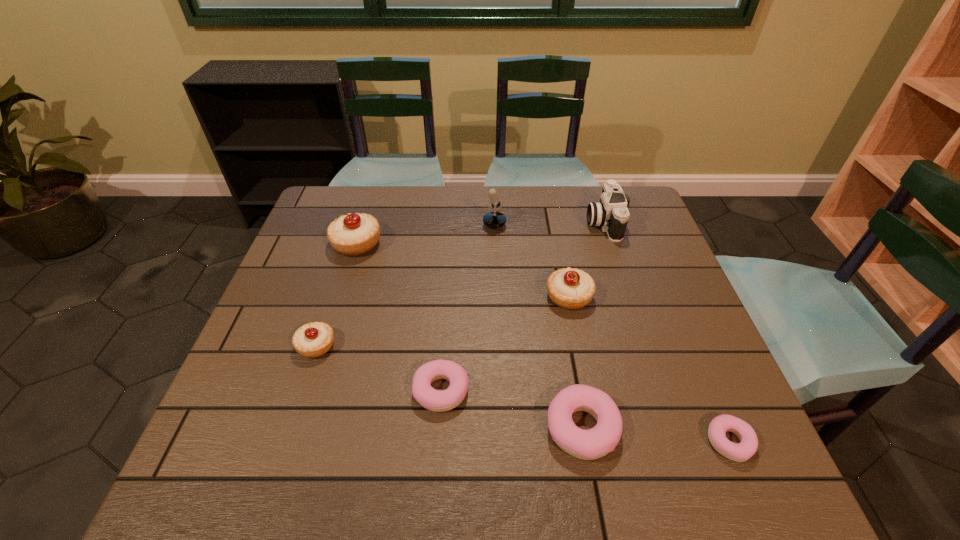
What are the coordinates of `free location located 0.060m on the left of the third shortest object` in the screenshot? It's located at (516, 428).

This screenshot has height=540, width=960. Find the location of `vacant space located on the back of the seventh tallest object`. vacant space located on the back of the seventh tallest object is located at coordinates (445, 333).

The width and height of the screenshot is (960, 540). Find the location of `vacant space situated 0.180m on the left of the rightmost object`. vacant space situated 0.180m on the left of the rightmost object is located at coordinates (614, 441).

The image size is (960, 540). In order to click on microphone at the far edge in this screenshot , I will do `click(495, 219)`.

The image size is (960, 540). In order to click on camera at the far edge in this screenshot , I will do `click(611, 213)`.

The height and width of the screenshot is (540, 960). I want to click on pastry situated at the far edge, so click(354, 234).

The height and width of the screenshot is (540, 960). In order to click on camera positioned at the right edge in this screenshot , I will do `click(611, 213)`.

Find the location of `pastry located in the right edge section of the desktop`. pastry located in the right edge section of the desktop is located at coordinates (748, 445).

The image size is (960, 540). What are the coordinates of `object located at the far left corner` in the screenshot? It's located at (354, 234).

Locate an element on the screen. Image resolution: width=960 pixels, height=540 pixels. object present at the far right corner is located at coordinates (611, 213).